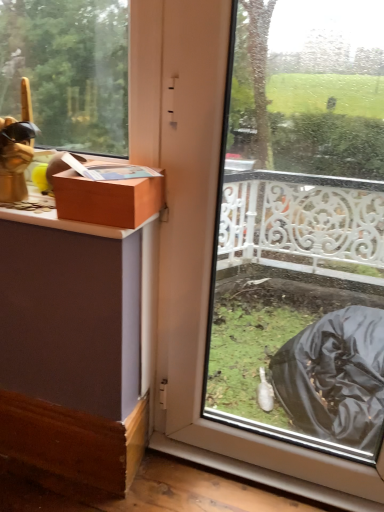
Question: Relative to transparent plastic bag at lower right, is matte brown box at upper left in front or behind?

Choices:
 (A) front
 (B) behind

Answer: (B)

Question: Based on their sizes in the image, would you say matte brown box at upper left is bigger or smaller than transparent plastic bag at lower right?

Choices:
 (A) big
 (B) small

Answer: (B)

Question: Is matte brown box at upper left spatially inside transparent plastic bag at lower right, or outside of it?

Choices:
 (A) outside
 (B) inside

Answer: (A)

Question: From the image's perspective, is transparent plastic bag at lower right located above or below matte brown box at upper left?

Choices:
 (A) above
 (B) below

Answer: (B)

Question: Considering the positions of transparent plastic bag at lower right and matte brown box at upper left in the image, is transparent plastic bag at lower right taller or shorter than matte brown box at upper left?

Choices:
 (A) short
 (B) tall

Answer: (B)

Question: Relative to matte brown box at upper left, is transparent plastic bag at lower right in front or behind?

Choices:
 (A) behind
 (B) front

Answer: (B)

Question: In terms of width, does transparent plastic bag at lower right look wider or thinner when compared to matte brown box at upper left?

Choices:
 (A) thin
 (B) wide

Answer: (A)